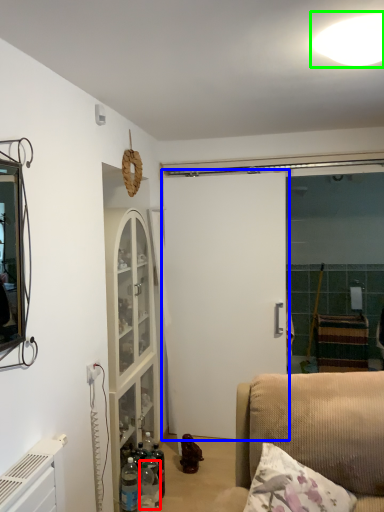
Question: Considering the real-world distances, which object is closest to bottle (highlighted by a red box)? door (highlighted by a blue box) or light (highlighted by a green box).

Choices:
 (A) door
 (B) light

Answer: (A)